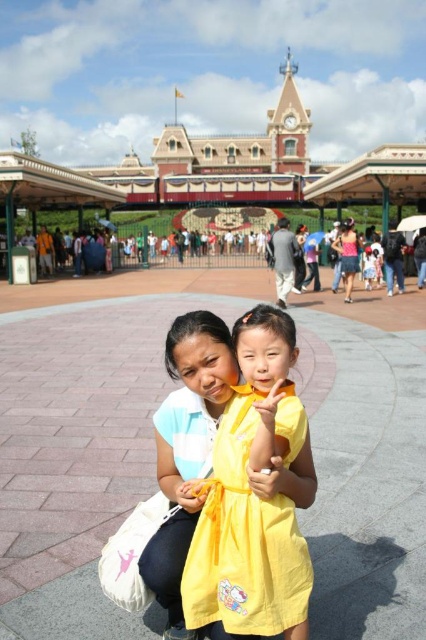
Describe the element at coordinates (210, 170) in the screenshot. I see `brick building at center` at that location.

Does brick building at center have a greater height compared to pink fabric skirt at center?

Indeed, brick building at center has a greater height compared to pink fabric skirt at center.

Locate an element on the screen. brick building at center is located at coordinates (210, 170).

Between yellow cotton dress at center and pink fabric skirt at center, which one appears on the left side from the viewer's perspective?

yellow cotton dress at center is more to the left.

Who is lower down, yellow cotton dress at center or pink fabric skirt at center?

yellow cotton dress at center is below.

Who is more distant from viewer, (287, 538) or (351, 273)?

Positioned behind is point (351, 273).

Locate an element on the screen. yellow cotton dress at center is located at coordinates (244, 541).

Between brick building at center and yellow cotton dress at center, which one appears on the left side from the viewer's perspective?

Positioned to the left is brick building at center.

Does brick building at center have a larger size compared to yellow cotton dress at center?

Yes.

Who is more forward, (397, 168) or (282, 564)?

Point (282, 564)

Find the location of a particular element. This screenshot has width=426, height=640. brick building at center is located at coordinates (210, 170).